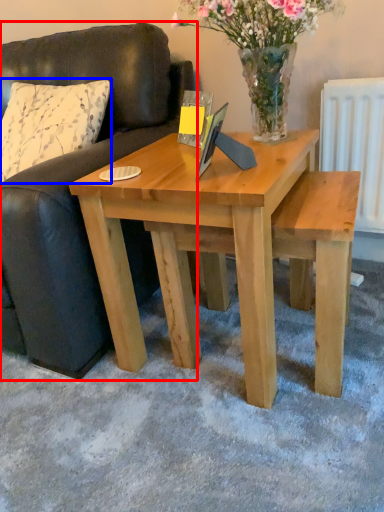
Question: Which of the following is the farthest to the observer, studio couch (highlighted by a red box) or pillow (highlighted by a blue box)?

Choices:
 (A) studio couch
 (B) pillow

Answer: (B)